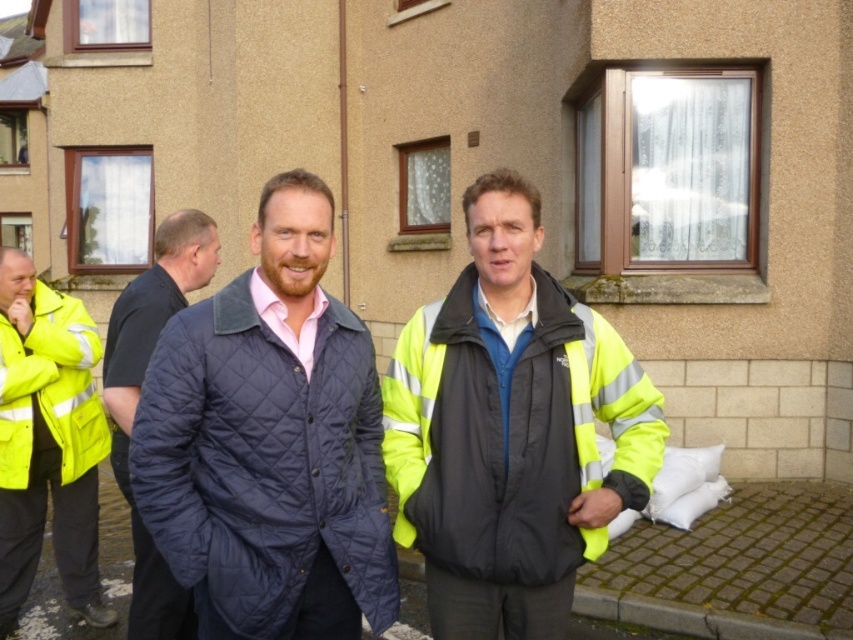
Question: Is navy quilted jacket at center further to the viewer compared to yellow reflective jacket at left?

Choices:
 (A) yes
 (B) no

Answer: (B)

Question: Does yellow reflective jacket at left have a larger size compared to dark blue quilted jacket at left?

Choices:
 (A) yes
 (B) no

Answer: (A)

Question: Where is navy quilted jacket at center located in relation to dark blue quilted jacket at left in the image?

Choices:
 (A) left
 (B) right

Answer: (B)

Question: Which object is farther from the camera taking this photo?

Choices:
 (A) dark blue quilted jacket at left
 (B) navy quilted jacket at center
 (C) yellow reflective jacket at left
 (D) high visibility fabric jacket at center

Answer: (C)

Question: Based on their relative distances, which object is nearer to the dark blue quilted jacket at left?

Choices:
 (A) yellow reflective jacket at left
 (B) navy quilted jacket at center
 (C) high visibility fabric jacket at center

Answer: (A)

Question: Which point is farther from the camera taking this photo?

Choices:
 (A) (154, 506)
 (B) (445, 515)

Answer: (B)